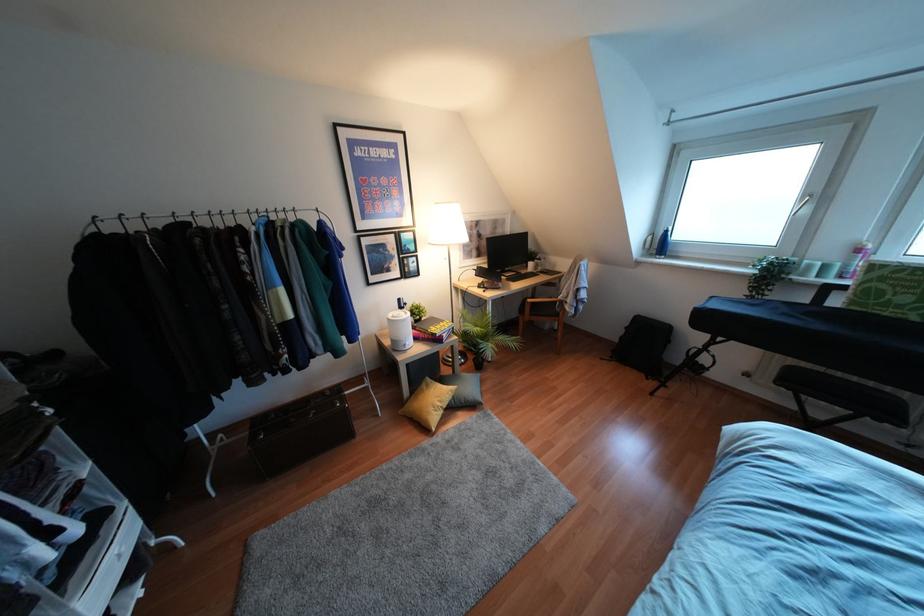
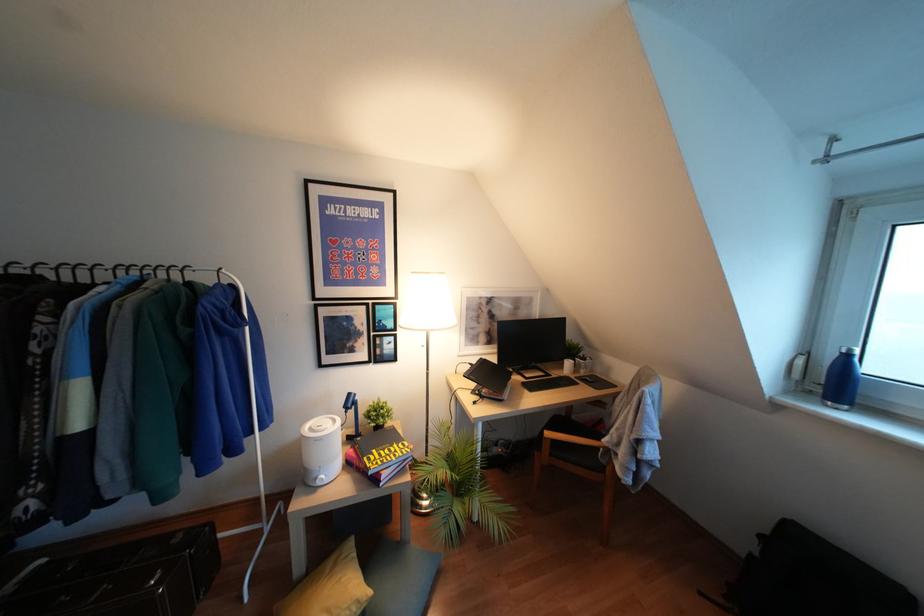
In a continuous first-person perspective shot, in which direction is the camera moving?

The movement direction of the cameraman is right, forward.